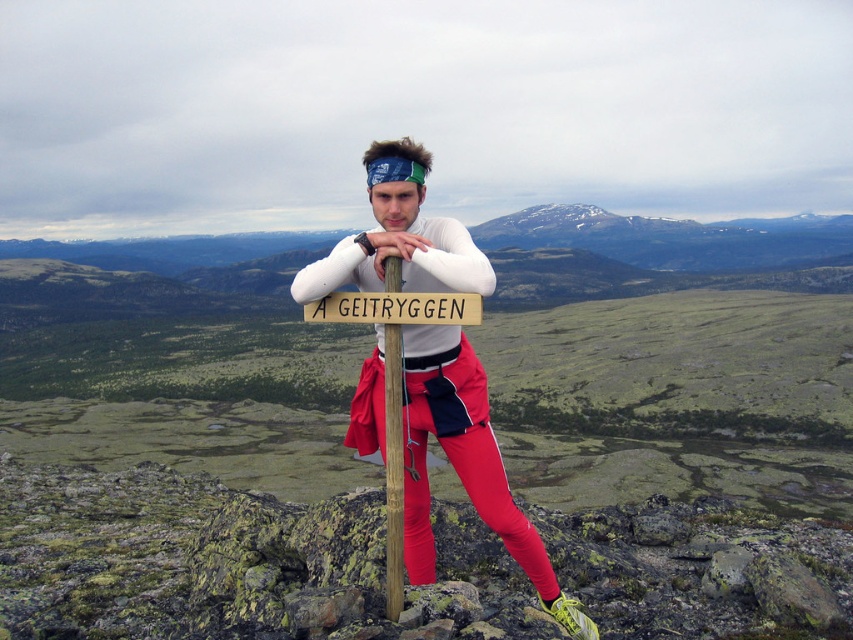
You are a hiker who wants to take a photo of the wooden signpost at center and the wooden sign at center. Which object will appear smaller in your photo?

The wooden signpost at center will appear smaller in the photo because it occupies less space than the wooden sign at center.

You are a hiker who just reached the wooden signpost at center. You want to take a photo of the signpost with the distant snow peaks in the background. Based on the signpost location, which direction should you face to include the snow peaks in the photo?

Since the wooden signpost at center is located at point (393, 468), you should face towards the distant snow peaks to capture them in the background of your photo with the signpost.